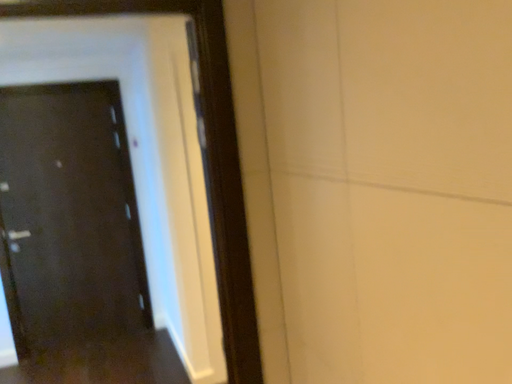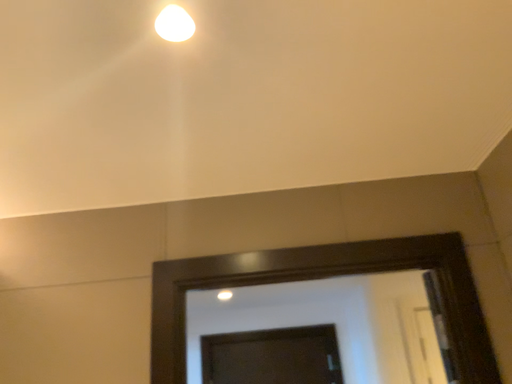
Question: How did the camera likely rotate when shooting the video?

Choices:
 (A) rotated left
 (B) rotated right

Answer: (A)